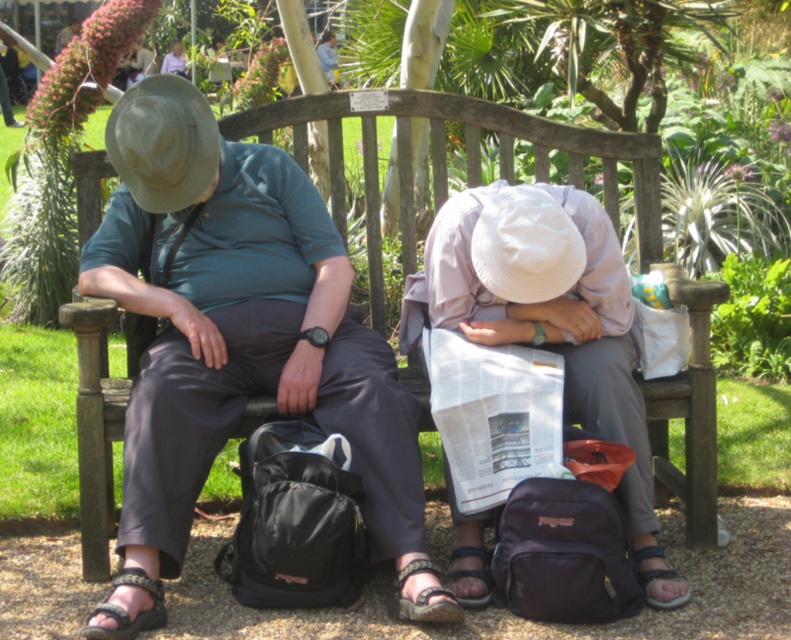
Question: Which point is farther from the camera taking this photo?

Choices:
 (A) (418, 317)
 (B) (267, 369)

Answer: (A)

Question: Does matte gray hat at left have a greater width compared to white matte hat at center?

Choices:
 (A) yes
 (B) no

Answer: (A)

Question: Does matte gray hat at left appear on the right side of white matte hat at center?

Choices:
 (A) yes
 (B) no

Answer: (B)

Question: Which object is farther from the camera taking this photo?

Choices:
 (A) white matte hat at center
 (B) matte gray hat at left

Answer: (A)

Question: Observing the image, what is the correct spatial positioning of matte gray hat at left in reference to white matte hat at center?

Choices:
 (A) below
 (B) above

Answer: (B)